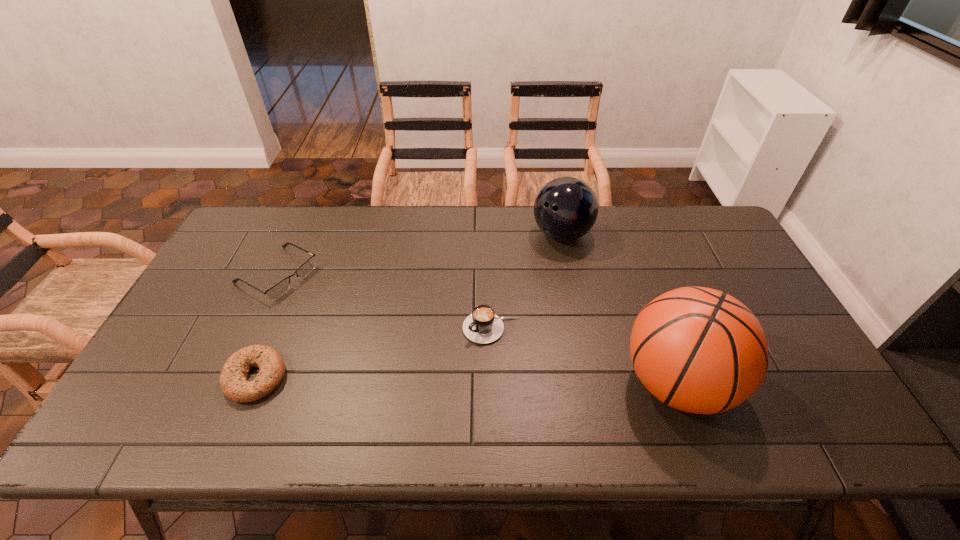
The image size is (960, 540). I want to click on vacant space that is in between the cappuccino and the spectacles, so click(384, 301).

This screenshot has width=960, height=540. Find the location of `vacant space that is in between the third shortest object and the spectacles`. vacant space that is in between the third shortest object and the spectacles is located at coordinates click(384, 301).

I want to click on unoccupied position between the cappuccino and the fourth shortest object, so click(x=527, y=281).

At what (x,y) coordinates should I click in order to perform the action: click on vacant point located between the third tallest object and the bowling ball. Please return your answer as a coordinate pair (x, y). Looking at the image, I should click on (527, 281).

This screenshot has height=540, width=960. I want to click on vacant area that lies between the basketball and the third object from right to left, so click(x=584, y=356).

Identify the location of vacant space that's between the basketball and the bagel. The height and width of the screenshot is (540, 960). (466, 380).

You are a GUI agent. You are given a task and a screenshot of the screen. Output one action in this format:
    pyautogui.click(x=<x>, y=<y>)
    Task: Click on the vacant point located between the third object from right to left and the fourth shortest object
    
    Given the screenshot: What is the action you would take?
    pyautogui.click(x=527, y=281)

In order to click on free space between the second tallest object and the spectacles in this screenshot , I will do `click(420, 254)`.

Locate an element on the screen. Image resolution: width=960 pixels, height=540 pixels. vacant space in between the spectacles and the second tallest object is located at coordinates (420, 254).

I want to click on object that stands as the closest to the bagel, so click(x=279, y=289).